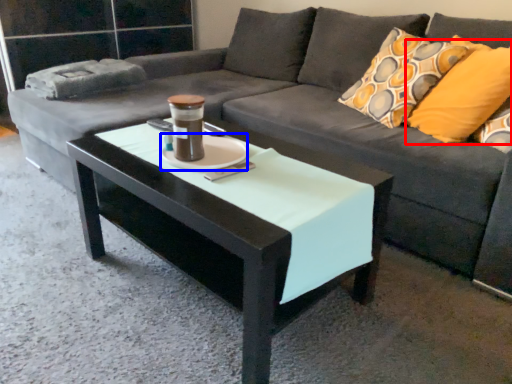
Question: Among these objects, which one is farthest to the camera, pillow (highlighted by a red box) or saucer (highlighted by a blue box)?

Choices:
 (A) pillow
 (B) saucer

Answer: (A)